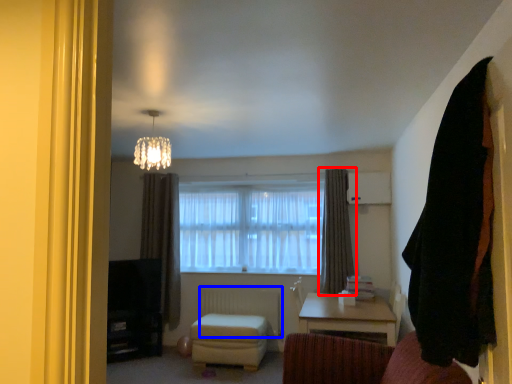
Question: Which object is further to the camera taking this photo, curtain (highlighted by a red box) or radiator (highlighted by a blue box)?

Choices:
 (A) curtain
 (B) radiator

Answer: (B)